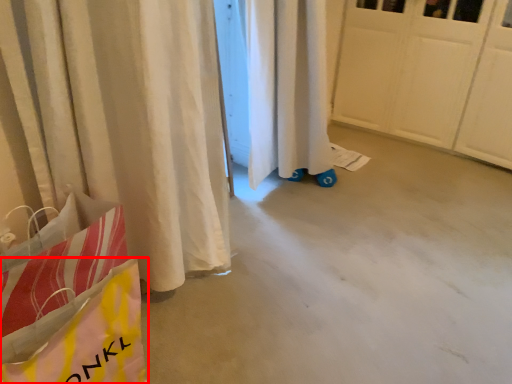
Question: In this image, where is grocery bag (annotated by the red box) located relative to concrete?

Choices:
 (A) right
 (B) left

Answer: (B)